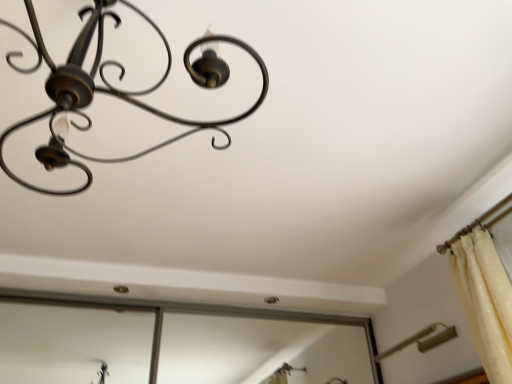
Measure the distance between point [410,337] and camera.

6.94 feet.

What do you see at coordinates (422, 340) in the screenshot?
I see `metallic gold lamp at lower right, acting as the 1th lamp starting from the right` at bounding box center [422, 340].

This screenshot has width=512, height=384. Identify the location of metallic gold lamp at lower right, which is the second lamp from top to bottom. (422, 340).

The width and height of the screenshot is (512, 384). Describe the element at coordinates (114, 89) in the screenshot. I see `matte black chandelier at upper left, the first lamp viewed from the top` at that location.

Identify the location of matte black chandelier at upper left, the first lamp viewed from the top. The height and width of the screenshot is (384, 512). (114, 89).

At what (x,y) coordinates should I click in order to perform the action: click on metallic gold lamp at lower right, marked as the 2th lamp in a left-to-right arrangement. Please return your answer as a coordinate pair (x, y). Looking at the image, I should click on (422, 340).

Considering the relative positions of matte black chandelier at upper left, which is the 2th lamp in back-to-front order, and metallic gold lamp at lower right, which is the first lamp from bottom to top, in the image provided, is matte black chandelier at upper left, which is the 2th lamp in back-to-front order, to the left or to the right of metallic gold lamp at lower right, which is the first lamp from bottom to top,?

matte black chandelier at upper left, which is the 2th lamp in back-to-front order, is positioned on metallic gold lamp at lower right, which is the first lamp from bottom to top,'s left side.

From the picture: Is matte black chandelier at upper left, which is the 2th lamp in right-to-left order, closer to the viewer compared to metallic gold lamp at lower right, acting as the second lamp starting from the front?

Yes, matte black chandelier at upper left, which is the 2th lamp in right-to-left order, is in front of metallic gold lamp at lower right, acting as the second lamp starting from the front.

Between point (225, 125) and point (385, 354), which one is positioned behind?

The point (385, 354) is behind.

From the image's perspective, would you say matte black chandelier at upper left, which is the 2th lamp in back-to-front order, is shown under metallic gold lamp at lower right, which ranks as the 1th lamp in back-to-front order?

Incorrect, from the image's perspective, matte black chandelier at upper left, which is the 2th lamp in back-to-front order, is higher than metallic gold lamp at lower right, which ranks as the 1th lamp in back-to-front order.

From a real-world perspective, is matte black chandelier at upper left, the 1th lamp viewed from the left, located higher than metallic gold lamp at lower right, acting as the 1th lamp starting from the right?

Yes, from a real-world perspective, matte black chandelier at upper left, the 1th lamp viewed from the left, is on top of metallic gold lamp at lower right, acting as the 1th lamp starting from the right.

Looking at their sizes, would you say matte black chandelier at upper left, which appears as the second lamp when ordered from the bottom, is wider or thinner than metallic gold lamp at lower right, acting as the second lamp starting from the front?

matte black chandelier at upper left, which appears as the second lamp when ordered from the bottom, is wider than metallic gold lamp at lower right, acting as the second lamp starting from the front.

Between matte black chandelier at upper left, the 1th lamp viewed from the left, and metallic gold lamp at lower right, which is the first lamp from bottom to top, which one has less height?

With less height is metallic gold lamp at lower right, which is the first lamp from bottom to top.

Considering the sizes of objects matte black chandelier at upper left, which is the 2th lamp in back-to-front order, and metallic gold lamp at lower right, acting as the 1th lamp starting from the right, in the image provided, who is bigger, matte black chandelier at upper left, which is the 2th lamp in back-to-front order, or metallic gold lamp at lower right, acting as the 1th lamp starting from the right,?

matte black chandelier at upper left, which is the 2th lamp in back-to-front order.

Choose the correct answer: Is matte black chandelier at upper left, the 1th lamp viewed from the left, inside metallic gold lamp at lower right, which ranks as the 1th lamp in back-to-front order, or outside it?

matte black chandelier at upper left, the 1th lamp viewed from the left, is spatially situated outside metallic gold lamp at lower right, which ranks as the 1th lamp in back-to-front order.

Is matte black chandelier at upper left, which is the 2th lamp in back-to-front order, next to metallic gold lamp at lower right, which is the first lamp from bottom to top, and touching it?

No, matte black chandelier at upper left, which is the 2th lamp in back-to-front order, is not beside metallic gold lamp at lower right, which is the first lamp from bottom to top.

Could you tell me if matte black chandelier at upper left, which appears as the second lamp when ordered from the bottom, is facing metallic gold lamp at lower right, marked as the 2th lamp in a left-to-right arrangement?

No, matte black chandelier at upper left, which appears as the second lamp when ordered from the bottom, does not turn towards metallic gold lamp at lower right, marked as the 2th lamp in a left-to-right arrangement.

Can you tell me how much matte black chandelier at upper left, which is the 2th lamp in back-to-front order, and metallic gold lamp at lower right, which is the second lamp from top to bottom, differ in facing direction?

There is a 0.846-degree angle between the facing directions of matte black chandelier at upper left, which is the 2th lamp in back-to-front order, and metallic gold lamp at lower right, which is the second lamp from top to bottom.

Image resolution: width=512 pixels, height=384 pixels. I want to click on lamp below the matte black chandelier at upper left, the first lamp viewed from the top (from a real-world perspective), so click(x=422, y=340).

Considering the relative positions of metallic gold lamp at lower right, acting as the second lamp starting from the front, and matte black chandelier at upper left, the 1th lamp viewed from the left, in the image provided, is metallic gold lamp at lower right, acting as the second lamp starting from the front, to the left or to the right of matte black chandelier at upper left, the 1th lamp viewed from the left,?

metallic gold lamp at lower right, acting as the second lamp starting from the front, is positioned on matte black chandelier at upper left, the 1th lamp viewed from the left,'s right side.

Is metallic gold lamp at lower right, which is the second lamp from top to bottom, in front of or behind matte black chandelier at upper left, which is the 2th lamp in right-to-left order, in the image?

metallic gold lamp at lower right, which is the second lamp from top to bottom, is behind matte black chandelier at upper left, which is the 2th lamp in right-to-left order.

Does point (387, 350) appear closer or farther from the camera than point (95, 3)?

Point (387, 350) appears to be farther away from the viewer than point (95, 3).

From the image's perspective, is metallic gold lamp at lower right, marked as the 2th lamp in a left-to-right arrangement, positioned above or below matte black chandelier at upper left, which is the 2th lamp in back-to-front order?

metallic gold lamp at lower right, marked as the 2th lamp in a left-to-right arrangement, is below matte black chandelier at upper left, which is the 2th lamp in back-to-front order.

From the picture: From a real-world perspective, relative to matte black chandelier at upper left, which ranks as the first lamp in front-to-back order, is metallic gold lamp at lower right, acting as the 1th lamp starting from the right, vertically above or below?

In terms of real-world spatial position, metallic gold lamp at lower right, acting as the 1th lamp starting from the right, is below matte black chandelier at upper left, which ranks as the first lamp in front-to-back order.

Considering the relative sizes of metallic gold lamp at lower right, acting as the second lamp starting from the front, and matte black chandelier at upper left, which is the 2th lamp in back-to-front order, in the image provided, is metallic gold lamp at lower right, acting as the second lamp starting from the front, thinner than matte black chandelier at upper left, which is the 2th lamp in back-to-front order,?

Yes, metallic gold lamp at lower right, acting as the second lamp starting from the front, is thinner than matte black chandelier at upper left, which is the 2th lamp in back-to-front order.

Who is shorter, metallic gold lamp at lower right, acting as the 1th lamp starting from the right, or matte black chandelier at upper left, which is the 2th lamp in right-to-left order?

metallic gold lamp at lower right, acting as the 1th lamp starting from the right, is shorter.

Considering the relative sizes of metallic gold lamp at lower right, which ranks as the 1th lamp in back-to-front order, and matte black chandelier at upper left, the first lamp viewed from the top, in the image provided, is metallic gold lamp at lower right, which ranks as the 1th lamp in back-to-front order, smaller than matte black chandelier at upper left, the first lamp viewed from the top,?

Correct, metallic gold lamp at lower right, which ranks as the 1th lamp in back-to-front order, occupies less space than matte black chandelier at upper left, the first lamp viewed from the top.

Is matte black chandelier at upper left, which is the 2th lamp in right-to-left order, inside metallic gold lamp at lower right, which is the second lamp from top to bottom?

Actually, matte black chandelier at upper left, which is the 2th lamp in right-to-left order, is outside metallic gold lamp at lower right, which is the second lamp from top to bottom.

Is metallic gold lamp at lower right, acting as the second lamp starting from the front, directly adjacent to matte black chandelier at upper left, the first lamp viewed from the top?

No, metallic gold lamp at lower right, acting as the second lamp starting from the front, is not beside matte black chandelier at upper left, the first lamp viewed from the top.

Is metallic gold lamp at lower right, which is the first lamp from bottom to top, oriented away from matte black chandelier at upper left, which is the 2th lamp in right-to-left order?

No, metallic gold lamp at lower right, which is the first lamp from bottom to top, is not facing away from matte black chandelier at upper left, which is the 2th lamp in right-to-left order.

Based on the photo, can you tell me how much metallic gold lamp at lower right, which is the first lamp from bottom to top, and matte black chandelier at upper left, the 1th lamp viewed from the left, differ in facing direction?

The facing directions of metallic gold lamp at lower right, which is the first lamp from bottom to top, and matte black chandelier at upper left, the 1th lamp viewed from the left, are 0.846 degrees apart.

How distant is metallic gold lamp at lower right, acting as the 1th lamp starting from the right, from matte black chandelier at upper left, which is the 2th lamp in right-to-left order?

metallic gold lamp at lower right, acting as the 1th lamp starting from the right, and matte black chandelier at upper left, which is the 2th lamp in right-to-left order, are 5.33 feet apart.

Locate an element on the screen. The image size is (512, 384). lamp below the matte black chandelier at upper left, the 1th lamp viewed from the left (from a real-world perspective) is located at coordinates (422, 340).

The height and width of the screenshot is (384, 512). What are the coordinates of `lamp above the metallic gold lamp at lower right, which ranks as the 1th lamp in back-to-front order (from the image's perspective)` in the screenshot? It's located at (114, 89).

The height and width of the screenshot is (384, 512). Identify the location of lamp on the right of matte black chandelier at upper left, which appears as the second lamp when ordered from the bottom. (422, 340).